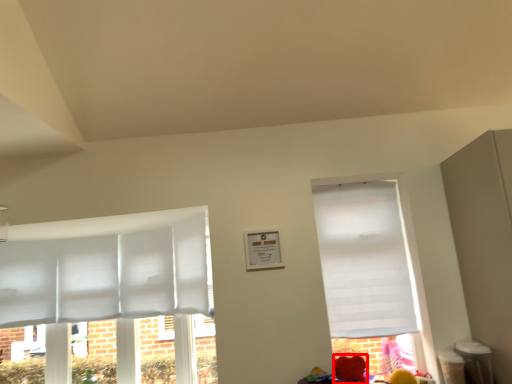
Question: Observing the image, what is the correct spatial positioning of flower (annotated by the red box) in reference to window?

Choices:
 (A) left
 (B) right

Answer: (A)